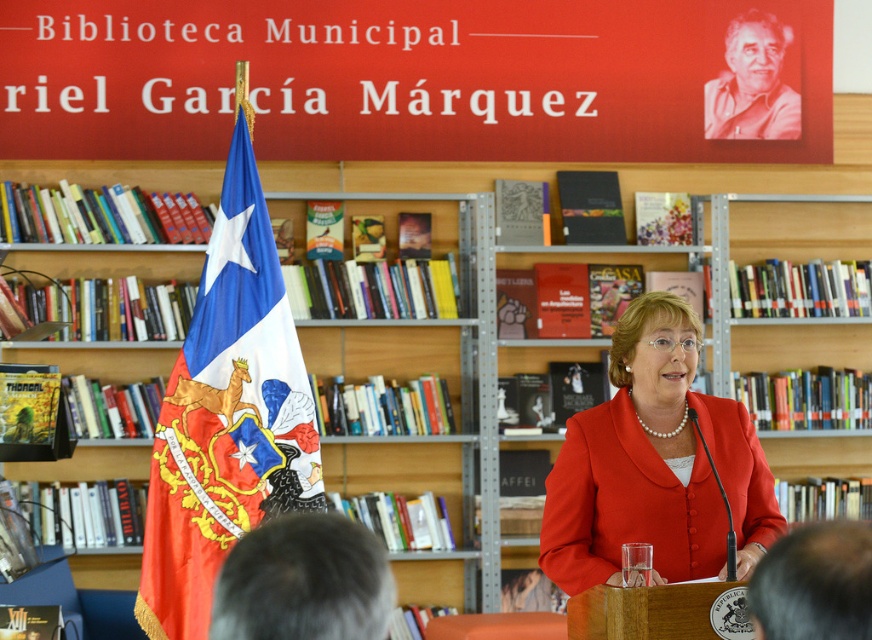
Question: Among these points, which one is nearest to the camera?

Choices:
 (A) (318, 445)
 (B) (857, 449)
 (C) (603, 566)

Answer: (C)

Question: Which point appears farthest from the camera in this image?

Choices:
 (A) (637, 515)
 (B) (99, 372)

Answer: (B)

Question: Is wooden bookshelf at center below matte red blazer at center?

Choices:
 (A) yes
 (B) no

Answer: (B)

Question: Which point is closer to the camera taking this photo?

Choices:
 (A) (332, 342)
 (B) (673, 440)

Answer: (B)

Question: Is the position of red fabric flag at left more distant than that of matte red blazer at center?

Choices:
 (A) no
 (B) yes

Answer: (B)

Question: Can you confirm if wooden bookshelf at center is positioned to the right of red fabric flag at left?

Choices:
 (A) no
 (B) yes

Answer: (B)